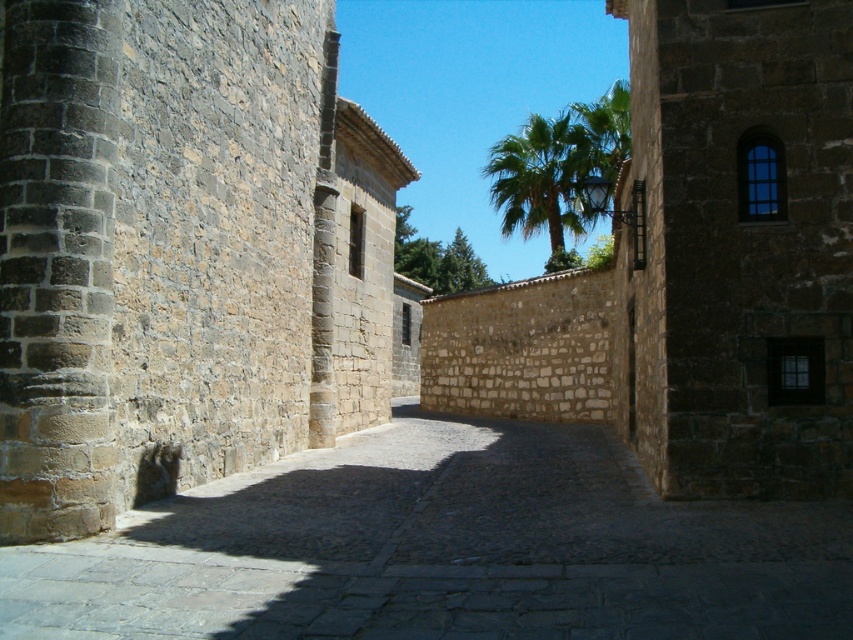
You are standing on the dark stone path at center and want to look up at the green leafy palm at upper center. Can you see the palm clearly without any obstruction?

Yes, the dark stone path at center is in front of green leafy palm at upper center, so there is no obstruction between them. You can see the palm clearly.

You are a tourist walking along the narrow cobblestone street. You notice the dark stone path at center and the green leafy palm at upper center. Which of these two objects appears larger in the image?

The green leafy palm at upper center appears larger than the dark stone path at center.

You are a delivery person carrying a large package and need to walk along the dark stone path at center. There is a green leafy palm at upper center nearby. Can you determine if the path is wide enough for your 1.2 meter wide cart?

The dark stone path at center is narrower than the green leafy palm at upper center. Since the path is less than 1.2 meters wide, the cart may not fit comfortably. Consider finding a wider path or adjusting your route.